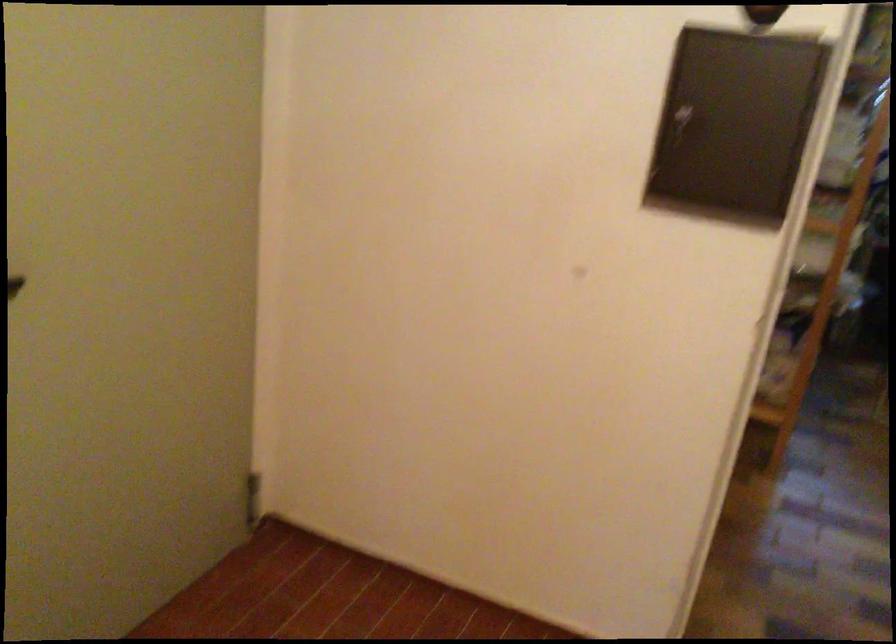
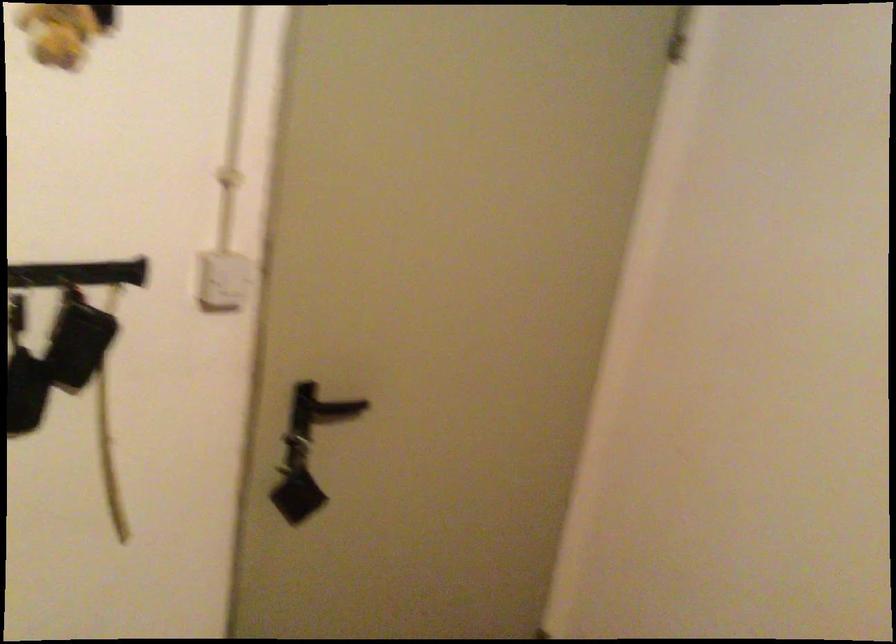
Question: The camera is either moving clockwise (left) or counter-clockwise (right) around the object. The first image is from the beginning of the video and the second image is from the end. Is the camera moving left or right when shooting the video?

Choices:
 (A) Left
 (B) Right

Answer: (B)